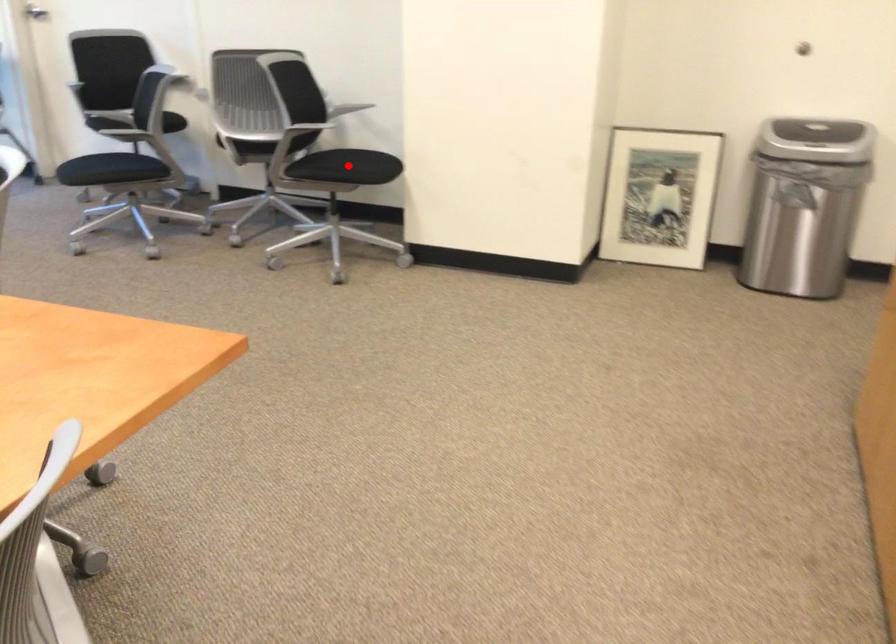
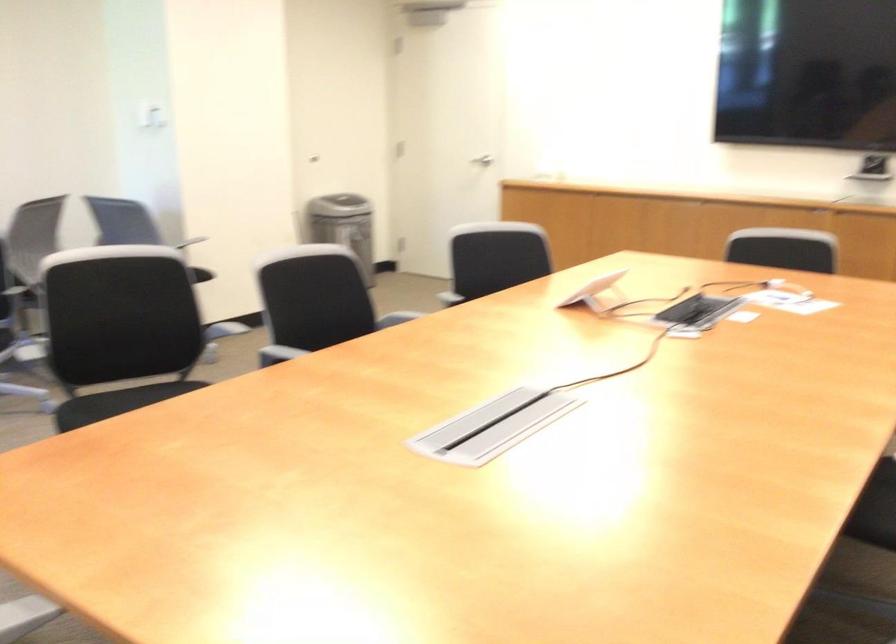
Question: I am providing you with two images of the same scene from different viewpoints. A red point is marked on the first image. At the location where the point appears in image 1, is it still visible in image 2?

Choices:
 (A) Yes
 (B) No

Answer: (B)